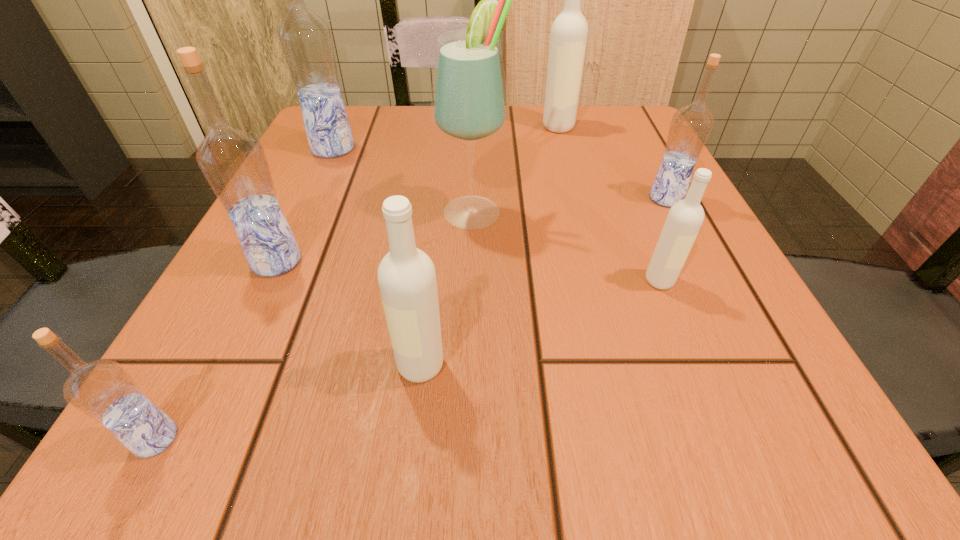
Locate an element on the screen. the fifth closest object to the nearest white vodka is located at coordinates (691, 125).

Locate which object is the second closest to the farthest object. Please provide its 2D coordinates. Your answer should be formatted as a tuple, i.e. [(x, y)], where the tuple contains the x and y coordinates of a point satisfying the conditions above.

[(469, 104)]

At what (x,y) coordinates should I click in order to perform the action: click on vodka that is the closest to the farthest white vodka. Please return your answer as a coordinate pair (x, y). This screenshot has height=540, width=960. Looking at the image, I should click on (691, 125).

Find the location of a particular element. the third closest vodka to the smallest white vodka is located at coordinates (569, 32).

Where is `the second closest blue vodka relative to the third farthest blue vodka`? The height and width of the screenshot is (540, 960). the second closest blue vodka relative to the third farthest blue vodka is located at coordinates (306, 42).

Select which blue vodka appears as the second closest to the sixth nearest vodka. Please provide its 2D coordinates. Your answer should be formatted as a tuple, i.e. [(x, y)], where the tuple contains the x and y coordinates of a point satisfying the conditions above.

[(103, 390)]

Where is `white vodka object that ranks as the closest to the third farthest blue vodka`? Image resolution: width=960 pixels, height=540 pixels. white vodka object that ranks as the closest to the third farthest blue vodka is located at coordinates (407, 280).

Point out which white vodka is positioned as the second nearest to the nearest vodka. Please provide its 2D coordinates. Your answer should be formatted as a tuple, i.e. [(x, y)], where the tuple contains the x and y coordinates of a point satisfying the conditions above.

[(684, 220)]

You are a GUI agent. You are given a task and a screenshot of the screen. Output one action in this format:
    pyautogui.click(x=<x>, y=<y>)
    Task: Click on the free region that satisfies the following two spatial constraints: 1. on the back side of the rightmost object; 2. on the right side of the third smallest blue vodka
    This screenshot has height=540, width=960.
    Given the screenshot: What is the action you would take?
    pyautogui.click(x=306, y=198)

Identify the location of vacant space that satisfies the following two spatial constraints: 1. on the front side of the rightmost object; 2. on the right side of the biggest blue vodka. The height and width of the screenshot is (540, 960). [x=310, y=198].